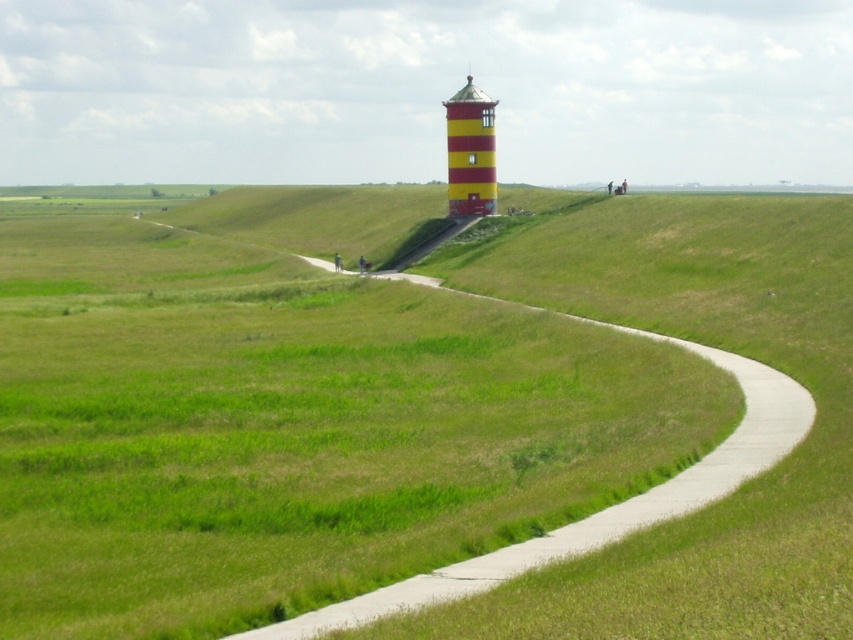
You are a landscape architect planning to install a new walkway between the green grass at upper center and the yellow striped tower at center. Which area has more space available for the walkway?

The green grass at upper center has a larger width than the yellow striped tower at center, so there is more space available for the walkway in the green grass at upper center area.

You are standing at the base of the lighthouse and want to take a photo of both the point at coordinates point (686,378) and point (482,156). Which point will appear larger in your photo?

Point (686,378) is closer to the camera than point (482,156), so it will appear larger in the photo.